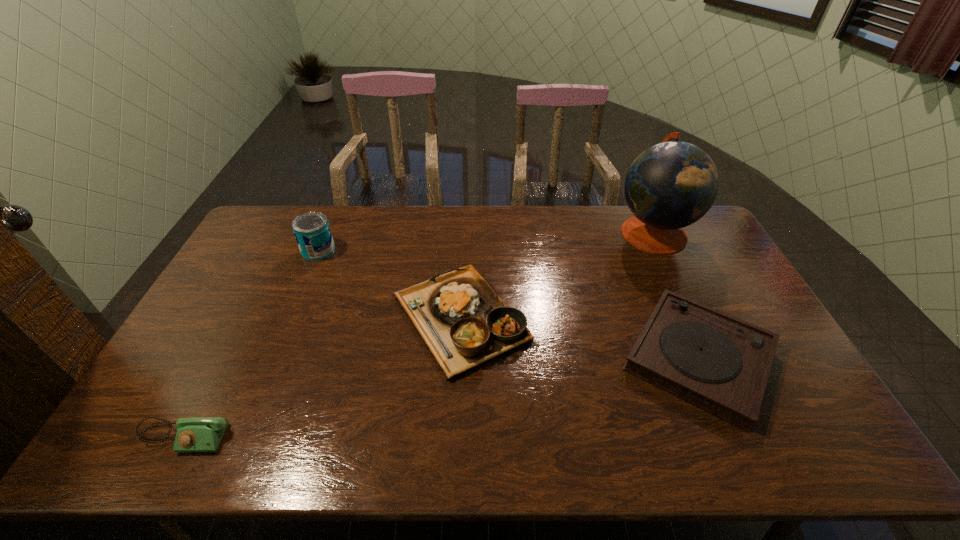
Find the location of a particular element. This screenshot has width=960, height=540. vacant space in between the telephone and the can is located at coordinates (252, 343).

Where is `unoccupied position between the telephone and the platter`? This screenshot has width=960, height=540. unoccupied position between the telephone and the platter is located at coordinates (323, 378).

Locate an element on the screen. Image resolution: width=960 pixels, height=540 pixels. vacant space in between the platter and the fourth shortest object is located at coordinates (390, 285).

Find the location of `vacant space that's between the telephone and the platter`. vacant space that's between the telephone and the platter is located at coordinates (323, 378).

Locate an element on the screen. free space between the phonograph record and the telephone is located at coordinates (442, 397).

Where is `vacant space in between the phonograph record and the can`? vacant space in between the phonograph record and the can is located at coordinates (509, 304).

This screenshot has width=960, height=540. In order to click on free space between the globe and the second tallest object in this screenshot , I will do `click(486, 241)`.

Find the location of a particular element. The height and width of the screenshot is (540, 960). object that is the third closest to the tallest object is located at coordinates (312, 231).

Locate an element on the screen. This screenshot has height=540, width=960. object that stands as the fourth closest to the phonograph record is located at coordinates (193, 434).

The height and width of the screenshot is (540, 960). I want to click on blank area in the image that satisfies the following two spatial constraints: 1. with the Americas facing the viewer on the globe; 2. on the front side of the third tallest object, so click(x=694, y=319).